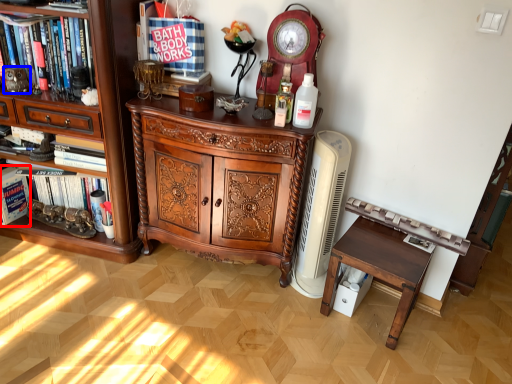
Question: Which point is closer to the camera, book (highlighted by a red box) or toy (highlighted by a blue box)?

Choices:
 (A) book
 (B) toy

Answer: (B)